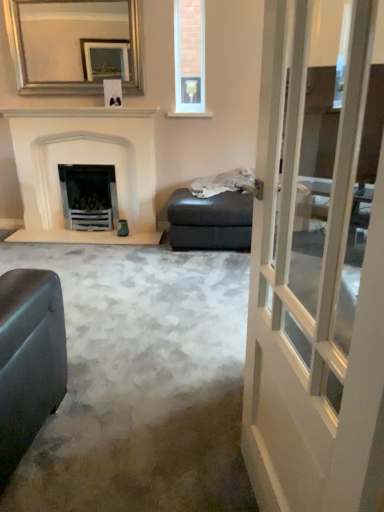
Measure the distance between silver metallic mirror at upper center and camera.

They are 3.36 meters apart.

The width and height of the screenshot is (384, 512). What are the coordinates of `matte gray footrest at center` in the screenshot? It's located at (210, 221).

Is white marble fireplace at left to the left or to the right of silver metallic mirror at upper center in the image?

Based on their positions, white marble fireplace at left is located to the left of silver metallic mirror at upper center.

Considering the sizes of objects white marble fireplace at left and silver metallic mirror at upper center in the image provided, who is bigger, white marble fireplace at left or silver metallic mirror at upper center?

white marble fireplace at left.

Considering the relative sizes of white marble fireplace at left and silver metallic mirror at upper center in the image provided, is white marble fireplace at left wider than silver metallic mirror at upper center?

Indeed, white marble fireplace at left has a greater width compared to silver metallic mirror at upper center.

Which is more distant, [136,207] or [135,31]?

Point [136,207]

Which object is closer to the camera, matte gray footrest at center or clear glass wine glass at upper center?

matte gray footrest at center is more forward.

From the image's perspective, is matte gray footrest at center on clear glass wine glass at upper center?

No, from the image's perspective, matte gray footrest at center is not over clear glass wine glass at upper center.

Who is smaller, matte gray footrest at center or clear glass wine glass at upper center?

With smaller size is clear glass wine glass at upper center.

Considering the sizes of objects matte gray footrest at center and clear glass wine glass at upper center in the image provided, who is wider, matte gray footrest at center or clear glass wine glass at upper center?

matte gray footrest at center is wider.

From the image's perspective, is clear glass wine glass at upper center positioned above or below white marble fireplace at left?

From the image's perspective, clear glass wine glass at upper center appears above white marble fireplace at left.

From a real-world perspective, is clear glass wine glass at upper center positioned above or below white marble fireplace at left?

Clearly, from a real-world perspective, clear glass wine glass at upper center is above white marble fireplace at left.

In the scene shown: Looking at their sizes, would you say clear glass wine glass at upper center is wider or thinner than white marble fireplace at left?

clear glass wine glass at upper center is thinner than white marble fireplace at left.

Is white marble fireplace at left facing towards matte gray footrest at center?

No, white marble fireplace at left is not facing towards matte gray footrest at center.

Considering the sizes of objects white marble fireplace at left and matte gray footrest at center in the image provided, who is bigger, white marble fireplace at left or matte gray footrest at center?

With larger size is white marble fireplace at left.

Based on the photo, choose the correct answer: Is white marble fireplace at left inside matte gray footrest at center or outside it?

white marble fireplace at left exists outside the volume of matte gray footrest at center.

Considering the sizes of objects clear glass wine glass at upper center and white glass door at center in the image provided, who is wider, clear glass wine glass at upper center or white glass door at center?

white glass door at center.

The image size is (384, 512). There is a white glass door at center. In order to click on window above it (from a real-world perspective) in this screenshot , I will do `click(189, 59)`.

From the image's perspective, would you say clear glass wine glass at upper center is shown under white glass door at center?

No.

Could you tell me if clear glass wine glass at upper center is facing white glass door at center?

Yes, clear glass wine glass at upper center is aimed at white glass door at center.

Considering the points (182, 189) and (19, 170), which point is behind, point (182, 189) or point (19, 170)?

Point (19, 170)

Is matte gray footrest at center bigger or smaller than white marble fireplace at left?

Considering their sizes, matte gray footrest at center takes up less space than white marble fireplace at left.

Is matte gray footrest at center thinner than white marble fireplace at left?

Incorrect, the width of matte gray footrest at center is not less than that of white marble fireplace at left.

Does silver metallic mirror at upper center turn towards matte gray footrest at center?

No.

From the image's perspective, which is below, silver metallic mirror at upper center or matte gray footrest at center?

matte gray footrest at center is shown below in the image.

Considering the positions of point (50, 53) and point (212, 229), is point (50, 53) closer or farther from the camera than point (212, 229)?

Point (50, 53) is positioned farther from the camera compared to point (212, 229).

Looking at this image, between silver metallic mirror at upper center and matte gray footrest at center, which one appears on the left side from the viewer's perspective?

silver metallic mirror at upper center.

Locate an element on the screen. fireplace below the silver metallic mirror at upper center (from the image's perspective) is located at coordinates (84, 163).

Where is `window behind the matte gray footrest at center`? The width and height of the screenshot is (384, 512). window behind the matte gray footrest at center is located at coordinates (189, 59).

Considering their positions, is clear glass wine glass at upper center positioned further to matte gray footrest at center than silver metallic mirror at upper center?

Based on the image, silver metallic mirror at upper center appears to be further to matte gray footrest at center.

Looking at the image, which one is located closer to matte gray footrest at center, white marble fireplace at left or clear glass wine glass at upper center?

white marble fireplace at left is positioned closer to the anchor matte gray footrest at center.

When comparing their distances from white marble fireplace at left, does white glass door at center or silver metallic mirror at upper center seem further?

Among the two, white glass door at center is located further to white marble fireplace at left.

When comparing their distances from silver metallic mirror at upper center, does white glass door at center or white marble fireplace at left seem further?

white glass door at center is positioned further to the anchor silver metallic mirror at upper center.

Based on the photo, which object lies nearer to the anchor point white glass door at center, white marble fireplace at left or silver metallic mirror at upper center?

The object closer to white glass door at center is white marble fireplace at left.

Based on their spatial positions, is white marble fireplace at left or white glass door at center further from clear glass wine glass at upper center?

The object further to clear glass wine glass at upper center is white glass door at center.

Looking at the image, which one is located closer to white glass door at center, clear glass wine glass at upper center or white marble fireplace at left?

The object closer to white glass door at center is clear glass wine glass at upper center.

When comparing their distances from matte gray footrest at center, does clear glass wine glass at upper center or white glass door at center seem closer?

clear glass wine glass at upper center.

I want to click on mirror between clear glass wine glass at upper center and white marble fireplace at left vertically, so click(x=74, y=45).

Find the location of `the footrest located between white glass door at center and white marble fireplace at left in the depth direction`. the footrest located between white glass door at center and white marble fireplace at left in the depth direction is located at coordinates (210, 221).

The height and width of the screenshot is (512, 384). I want to click on fireplace between white glass door at center and silver metallic mirror at upper center in the front-back direction, so click(x=84, y=163).

At what (x,y) coordinates should I click in order to perform the action: click on fireplace that lies between clear glass wine glass at upper center and matte gray footrest at center from top to bottom. Please return your answer as a coordinate pair (x, y). The image size is (384, 512). Looking at the image, I should click on (84, 163).